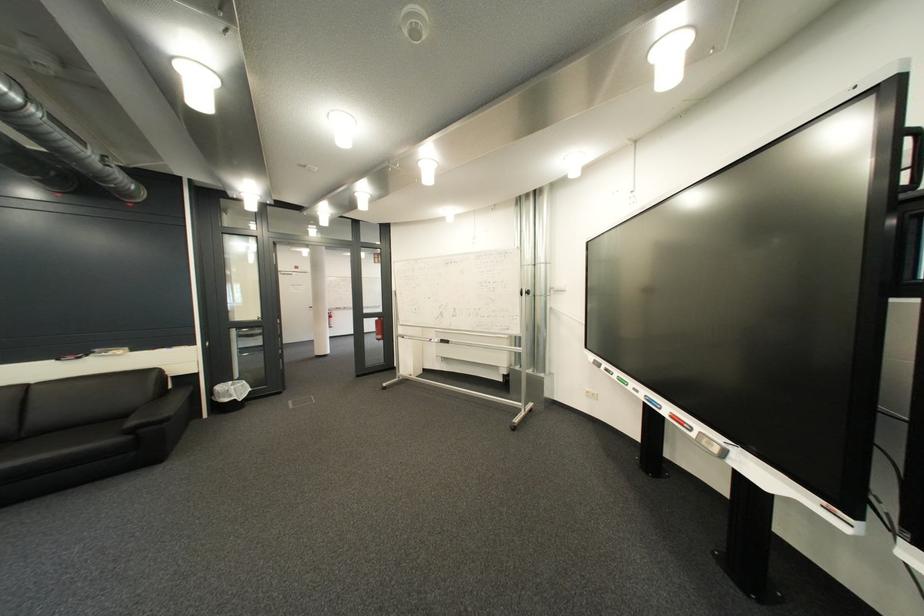
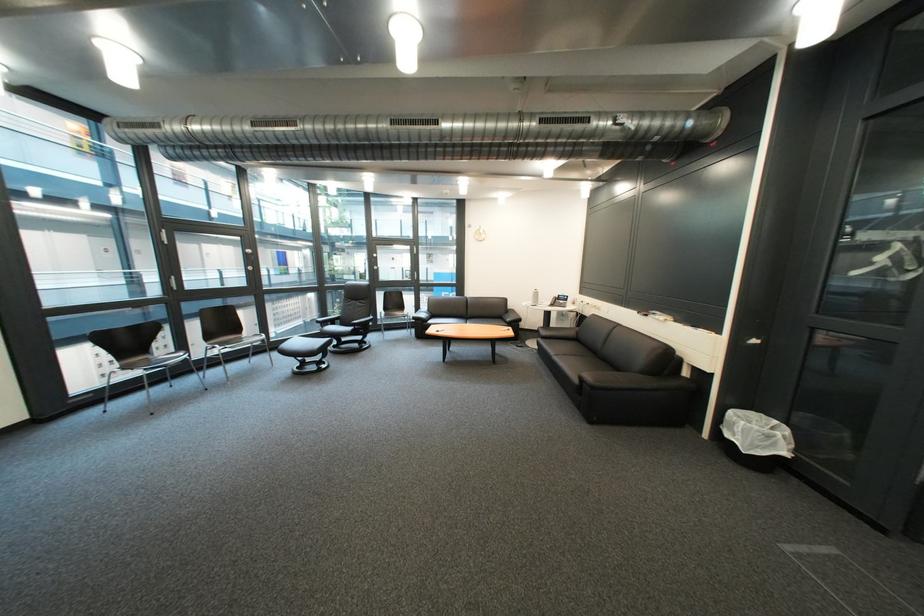
In the second image, find the point that corresponds to (x=144, y=432) in the first image.

(594, 381)